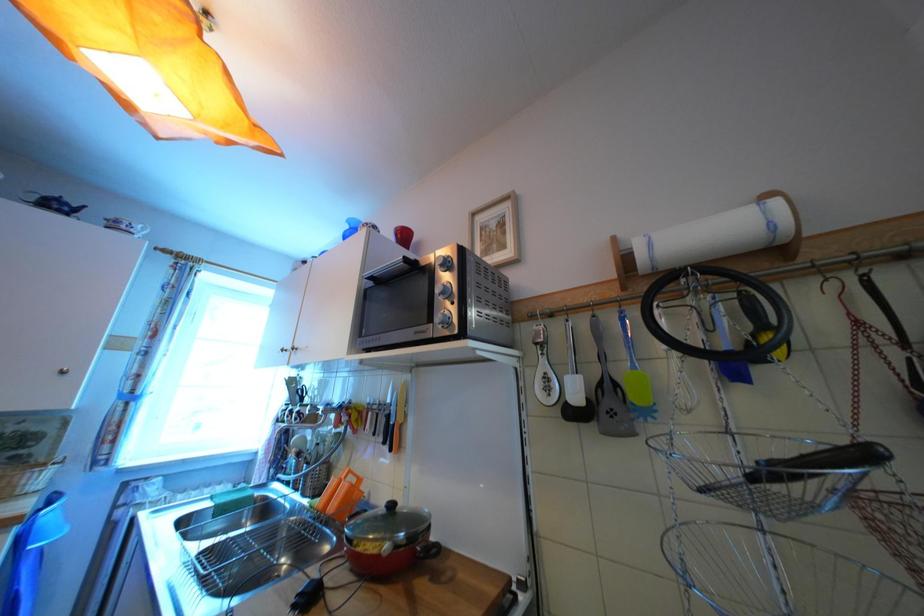
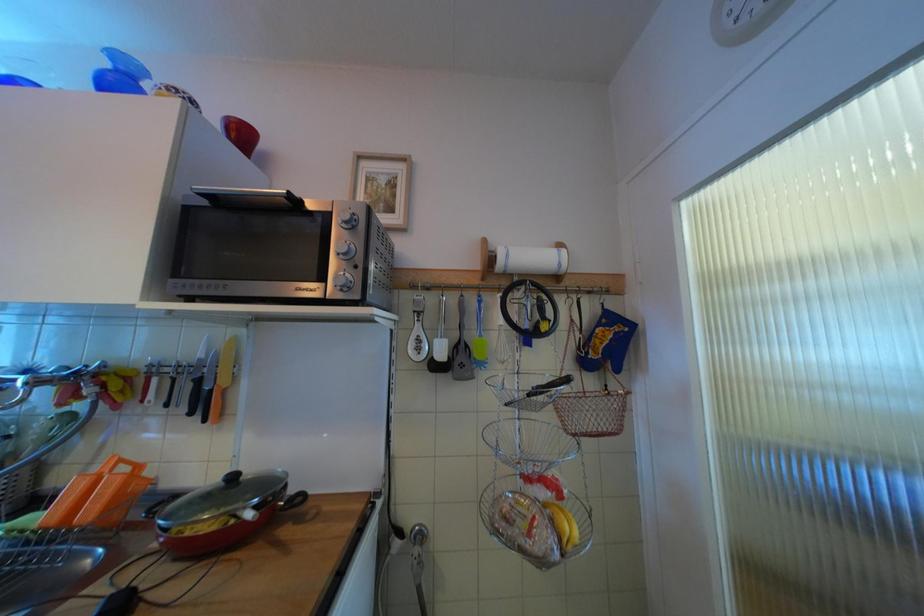
Question: The camera is either moving clockwise (left) or counter-clockwise (right) around the object. The first image is from the beginning of the video and the second image is from the end. Is the camera moving left or right when shooting the video?

Choices:
 (A) Left
 (B) Right

Answer: (A)